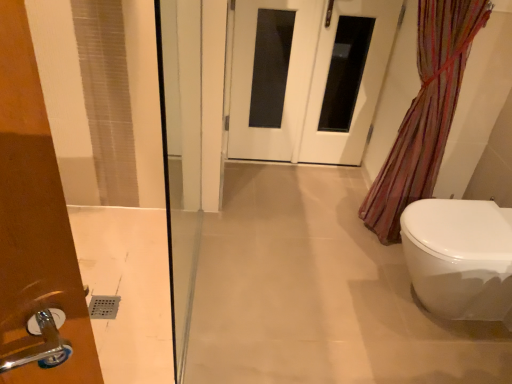
Where is `free space to the back side of translucent striped fabric at right`? This screenshot has width=512, height=384. free space to the back side of translucent striped fabric at right is located at coordinates (340, 197).